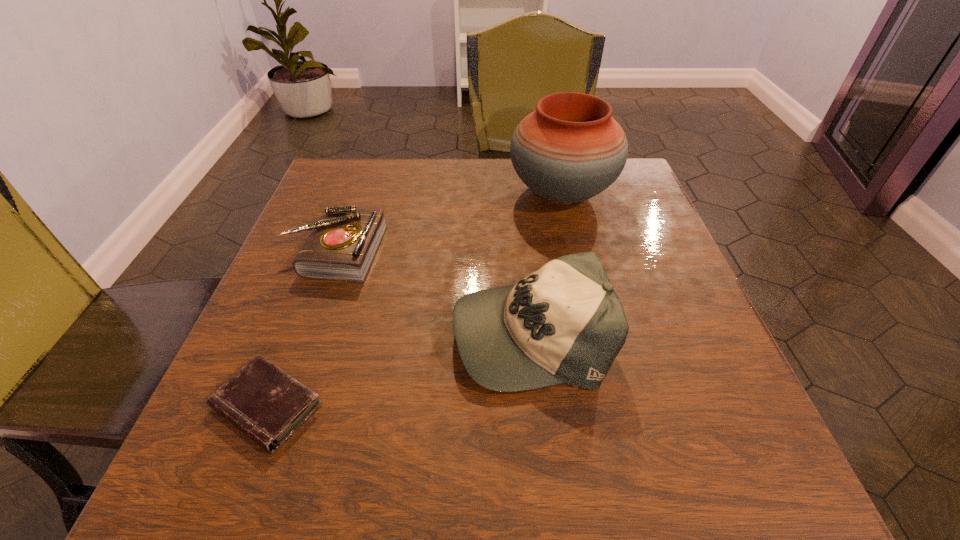
Locate an element on the screen. Image resolution: width=960 pixels, height=540 pixels. free space between the pottery and the second tallest object is located at coordinates 545,263.

Identify the location of blank region between the shortest object and the baseball cap. (398, 369).

Find the location of `free area in between the third tallest object and the nearer diary`. free area in between the third tallest object and the nearer diary is located at coordinates (301, 328).

Locate an element on the screen. vacant region between the baseball cap and the farther diary is located at coordinates (433, 292).

Locate which object is the third closest to the pottery. Please provide its 2D coordinates. Your answer should be formatted as a tuple, i.e. [(x, y)], where the tuple contains the x and y coordinates of a point satisfying the conditions above.

[(261, 400)]

You are a GUI agent. You are given a task and a screenshot of the screen. Output one action in this format:
    pyautogui.click(x=<x>, y=<y>)
    Task: Click on the object that is the nearest to the third tallest object
    
    Given the screenshot: What is the action you would take?
    pyautogui.click(x=564, y=323)

Where is `free location that satisfies the following two spatial constraints: 1. on the back side of the pottery; 2. on the left side of the taller diary`? The height and width of the screenshot is (540, 960). free location that satisfies the following two spatial constraints: 1. on the back side of the pottery; 2. on the left side of the taller diary is located at coordinates (356, 194).

The width and height of the screenshot is (960, 540). In order to click on vacant point that satisfies the following two spatial constraints: 1. on the back side of the third tallest object; 2. on the left side of the tallest object in this screenshot , I will do `click(356, 194)`.